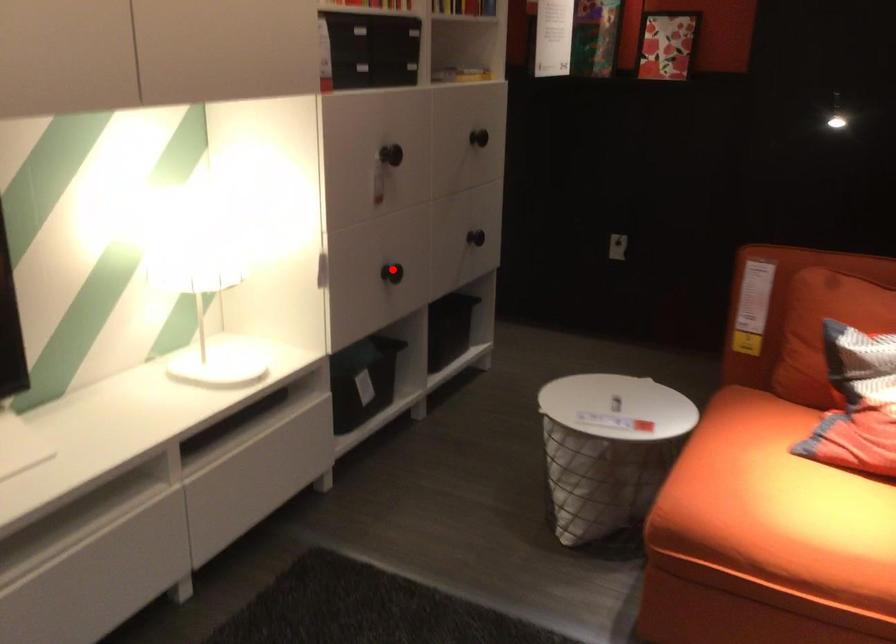
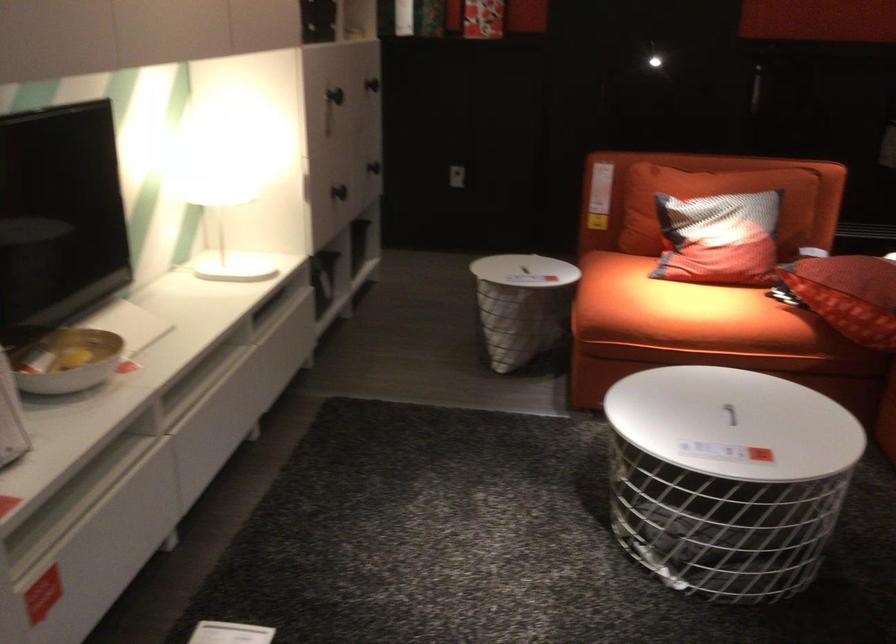
In the second image, find the point that corresponds to the highlighted location in the first image.

(339, 192)